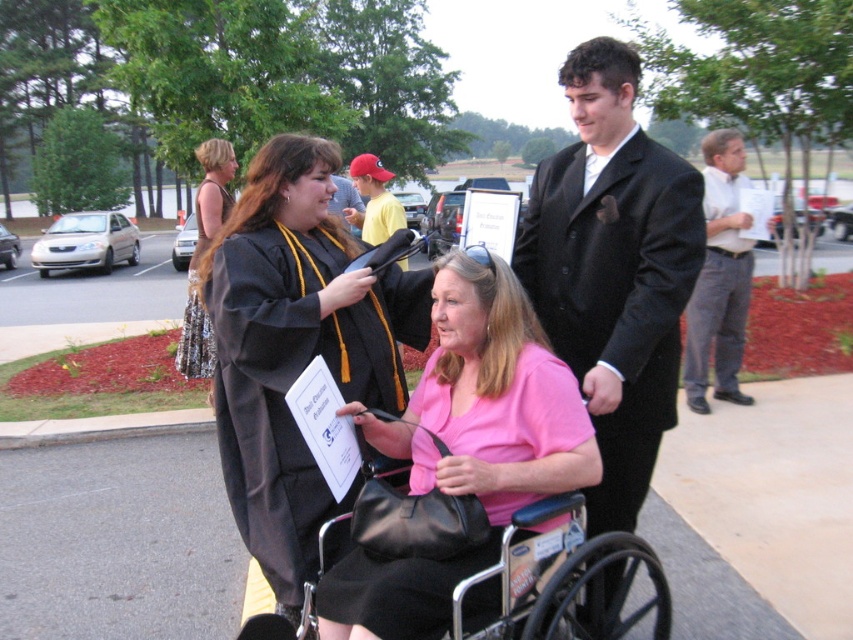
Question: Observing the image, what is the correct spatial positioning of pink matte dress at center in reference to sequined dress at upper left?

Choices:
 (A) below
 (B) above

Answer: (A)

Question: Which of the following is the farthest from the observer?

Choices:
 (A) (224, 164)
 (B) (378, 220)
 (C) (660, 566)
 (D) (235, 476)

Answer: (B)

Question: Which point is closer to the camera?

Choices:
 (A) (364, 224)
 (B) (465, 260)

Answer: (B)

Question: Can you confirm if matte black graduation gown at center is positioned to the right of metallic silver wheelchair at center?

Choices:
 (A) no
 (B) yes

Answer: (A)

Question: Can you confirm if metallic silver wheelchair at center is positioned to the left of sequined dress at upper left?

Choices:
 (A) yes
 (B) no

Answer: (B)

Question: Which of the following is the farthest from the observer?

Choices:
 (A) black wool suit at center
 (B) pink matte dress at center
 (C) white shirt at upper right

Answer: (C)